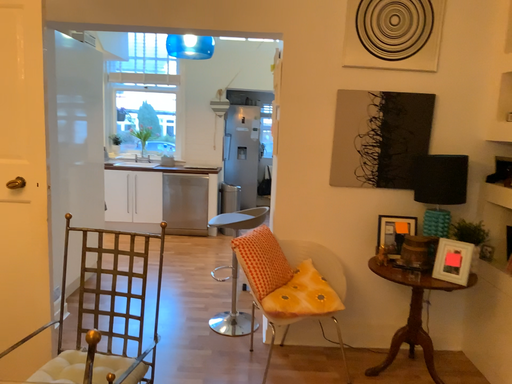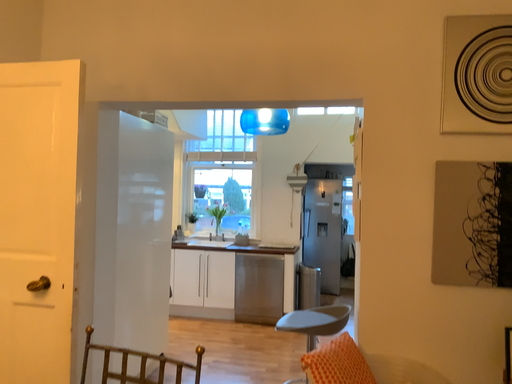
Question: How did the camera likely rotate when shooting the video?

Choices:
 (A) rotated left
 (B) rotated right

Answer: (A)